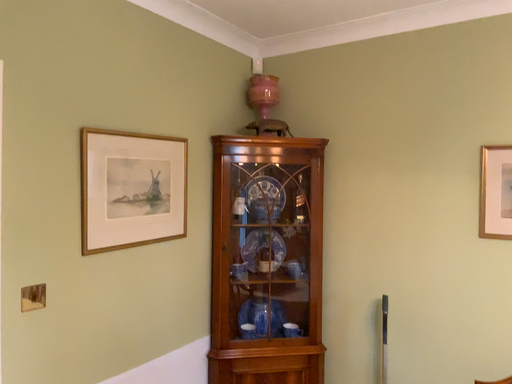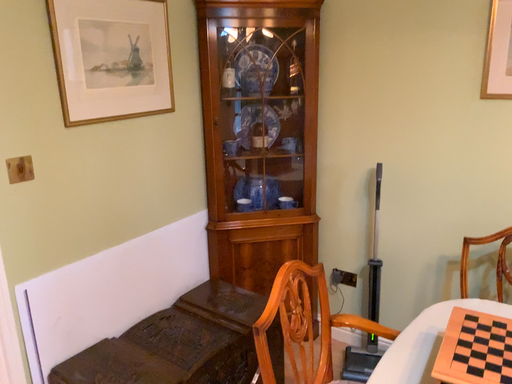
Question: How did the camera likely rotate when shooting the video?

Choices:
 (A) rotated upward
 (B) rotated downward

Answer: (B)